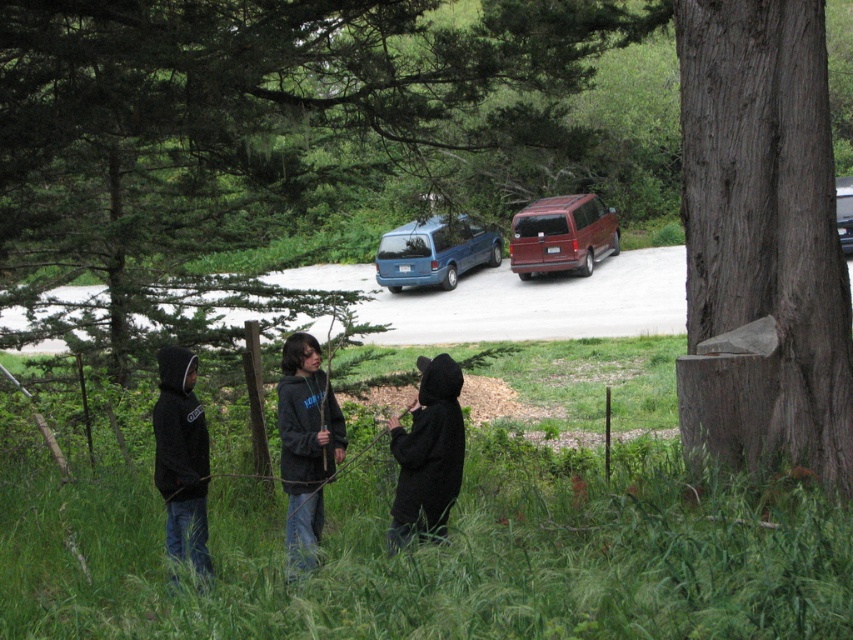
You are a delivery person trying to park your 2.2m tall truck behind the blue metallic van at center. The brown rough wooden post at center is blocking the path. Can you safely drive your truck past the post without hitting it?

The blue metallic van at center is taller than the brown rough wooden post at center. Since your truck is 2.2m tall and the post is shorter than the van, you should be able to safely drive past the post without hitting it as long as the post doesn

You are a photographer trying to capture both the black hoodie at center and the black hoodie at left in a single shot. Which hoodie should you focus on first to ensure both are in frame?

You should focus on the black hoodie at center first because it is taller than the black hoodie at left, so it will be easier to frame both in the shot.

In the scene shown: You are a delivery person who needs to find the black hoodie at center. According to the scene, where should you look to locate it?

The black hoodie at center is located at point [305,445].